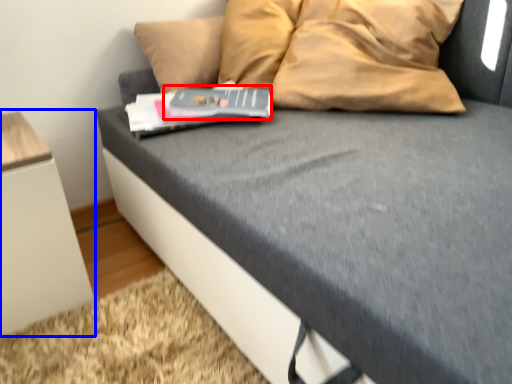
Question: Which object is further to the camera taking this photo, paperback book (highlighted by a red box) or furniture (highlighted by a blue box)?

Choices:
 (A) paperback book
 (B) furniture

Answer: (A)